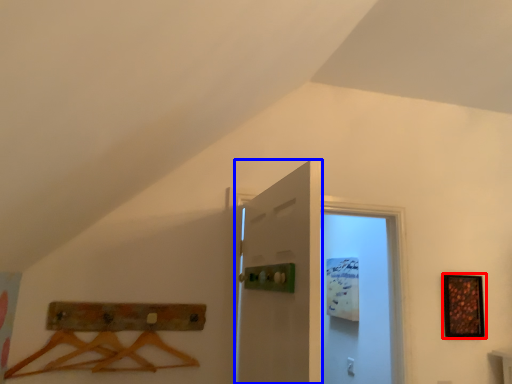
Question: Which of the following is the closest to the observer, picture frame (highlighted by a red box) or door (highlighted by a blue box)?

Choices:
 (A) picture frame
 (B) door

Answer: (B)